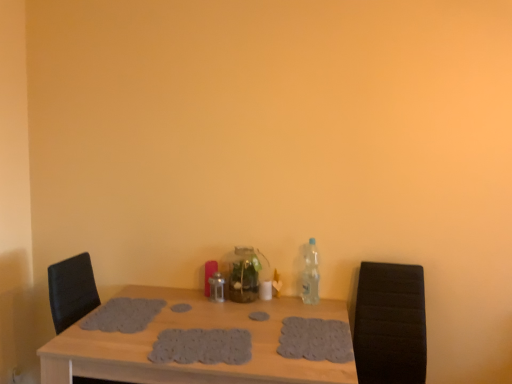
What are the coordinates of `vacant space in between clear plastic bottle at right, positioned as the second bottle in left-to-right order, and gray textured placemat at center, marked as the fourth footprint in a left-to-right arrangement` in the screenshot? It's located at (318, 312).